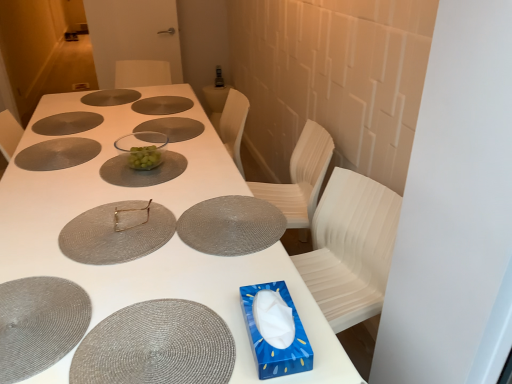
You are a GUI agent. You are given a task and a screenshot of the screen. Output one action in this format:
    pyautogui.click(x=<x>, y=<y>)
    Task: Click on the free space that is in between matte gray placemat at center, placed as the seventh glass plate when sorted from back to front, and blue paper tissue box at lower right
    The image size is (512, 384).
    Given the screenshot: What is the action you would take?
    pyautogui.click(x=248, y=276)